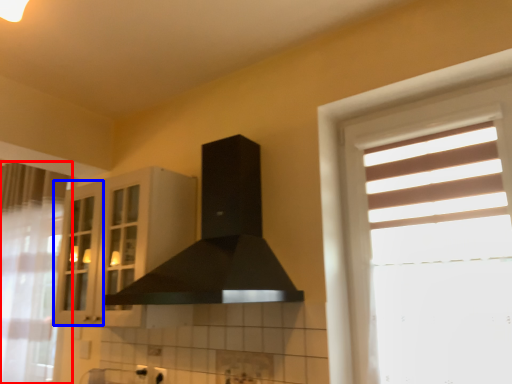
Question: Among these objects, which one is nearest to the camera, curtain (highlighted by a red box) or screen door (highlighted by a blue box)?

Choices:
 (A) curtain
 (B) screen door

Answer: (A)